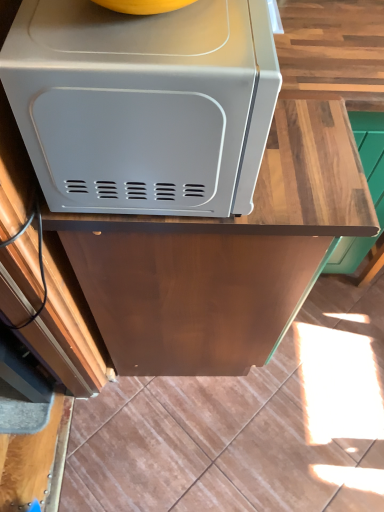
The height and width of the screenshot is (512, 384). What do you see at coordinates (224, 255) in the screenshot?
I see `wooden at upper center` at bounding box center [224, 255].

Identify the location of wooden at upper center. This screenshot has height=512, width=384. (224, 255).

This screenshot has height=512, width=384. What do you see at coordinates (144, 104) in the screenshot? I see `satin white microwave at upper left` at bounding box center [144, 104].

The height and width of the screenshot is (512, 384). In order to click on satin white microwave at upper left in this screenshot , I will do `click(144, 104)`.

Where is `wooden at upper center`? The height and width of the screenshot is (512, 384). wooden at upper center is located at coordinates (224, 255).

Which object is positioned more to the left, wooden at upper center or satin white microwave at upper left?

satin white microwave at upper left is more to the left.

Looking at this image, considering the relative positions of wooden at upper center and satin white microwave at upper left in the image provided, is wooden at upper center in front of satin white microwave at upper left?

No, the depth of wooden at upper center is greater than that of satin white microwave at upper left.

Does point (161, 352) come farther from viewer compared to point (241, 23)?

Yes, it is behind point (241, 23).

From the image's perspective, which one is positioned lower, wooden at upper center or satin white microwave at upper left?

From the image's view, wooden at upper center is below.

From a real-world perspective, is wooden at upper center located higher than satin white microwave at upper left?

No, from a real-world perspective, wooden at upper center is not on top of satin white microwave at upper left.

In the scene shown: Which of these two, wooden at upper center or satin white microwave at upper left, is thinner?

satin white microwave at upper left is thinner.

Does wooden at upper center have a greater height compared to satin white microwave at upper left?

Correct, wooden at upper center is much taller as satin white microwave at upper left.

Who is bigger, wooden at upper center or satin white microwave at upper left?

Bigger between the two is wooden at upper center.

Is wooden at upper center inside or outside of satin white microwave at upper left?

wooden at upper center is spatially situated outside satin white microwave at upper left.

Is the surface of wooden at upper center in direct contact with satin white microwave at upper left?

No, wooden at upper center is not beside satin white microwave at upper left.

Is wooden at upper center aimed at satin white microwave at upper left?

No, wooden at upper center is not oriented towards satin white microwave at upper left.

Can you tell me how much wooden at upper center and satin white microwave at upper left differ in facing direction?

The facing directions of wooden at upper center and satin white microwave at upper left are 0.329 degrees apart.

Based on the photo, measure the distance from wooden at upper center to satin white microwave at upper left.

wooden at upper center is 26.33 centimeters away from satin white microwave at upper left.

Identify the location of home appliance positioned vertically above the wooden at upper center (from a real-world perspective). (144, 104).

Can you confirm if satin white microwave at upper left is positioned to the left of wooden at upper center?

Correct, you'll find satin white microwave at upper left to the left of wooden at upper center.

Which object is closer to the camera, satin white microwave at upper left or wooden at upper center?

satin white microwave at upper left is closer to the camera.

Which point is more forward, (198,138) or (251,251)?

The point (198,138) is closer.

From the image's perspective, which one is positioned lower, satin white microwave at upper left or wooden at upper center?

wooden at upper center.

From a real-world perspective, does satin white microwave at upper left sit lower than wooden at upper center?

No, from a real-world perspective, satin white microwave at upper left is not below wooden at upper center.

Which object is wider, satin white microwave at upper left or wooden at upper center?

wooden at upper center.

Is satin white microwave at upper left taller or shorter than wooden at upper center?

Considering their sizes, satin white microwave at upper left has less height than wooden at upper center.

Which of these two, satin white microwave at upper left or wooden at upper center, is smaller?

With smaller size is satin white microwave at upper left.

Which is correct: satin white microwave at upper left is inside wooden at upper center, or outside of it?

satin white microwave at upper left is outside wooden at upper center.

Are satin white microwave at upper left and wooden at upper center beside each other?

There is a gap between satin white microwave at upper left and wooden at upper center.

Is satin white microwave at upper left positioned with its back to wooden at upper center?

satin white microwave at upper left does not have its back to wooden at upper center.

The image size is (384, 512). I want to click on home appliance above the wooden at upper center (from a real-world perspective), so (x=144, y=104).

This screenshot has height=512, width=384. Find the location of `counter that appears behind the satin white microwave at upper left`. counter that appears behind the satin white microwave at upper left is located at coordinates (224, 255).

The height and width of the screenshot is (512, 384). In order to click on home appliance on the left of the wooden at upper center in this screenshot , I will do `click(144, 104)`.